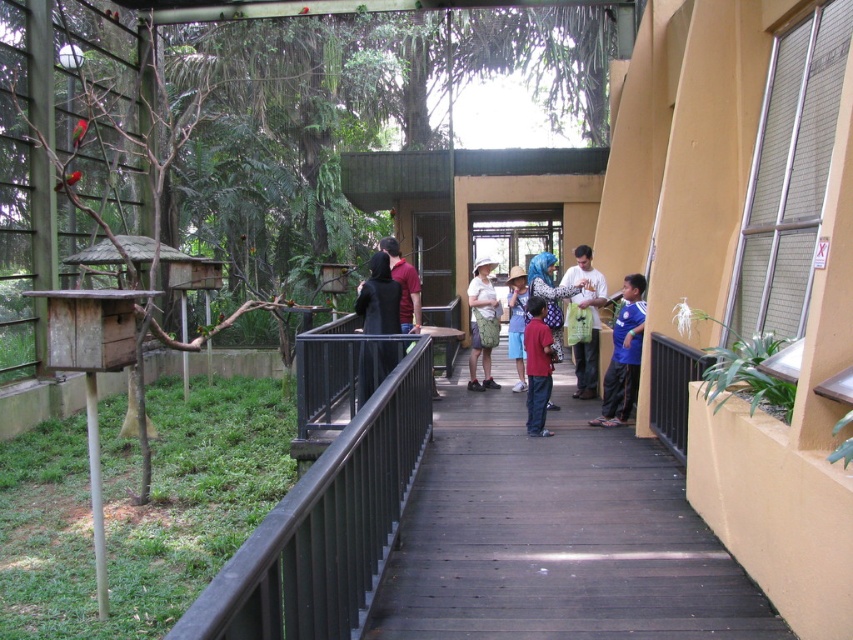
You are standing at point (369, 296) and want to move to the entrance of the zoo sanctuary which is located at point (590, 278). Can you walk directly to the entrance without moving around any obstacles?

Point (590, 278) is behind point (369, 296), so you cannot walk directly to the entrance without moving around the obstacle at point (369, 296).